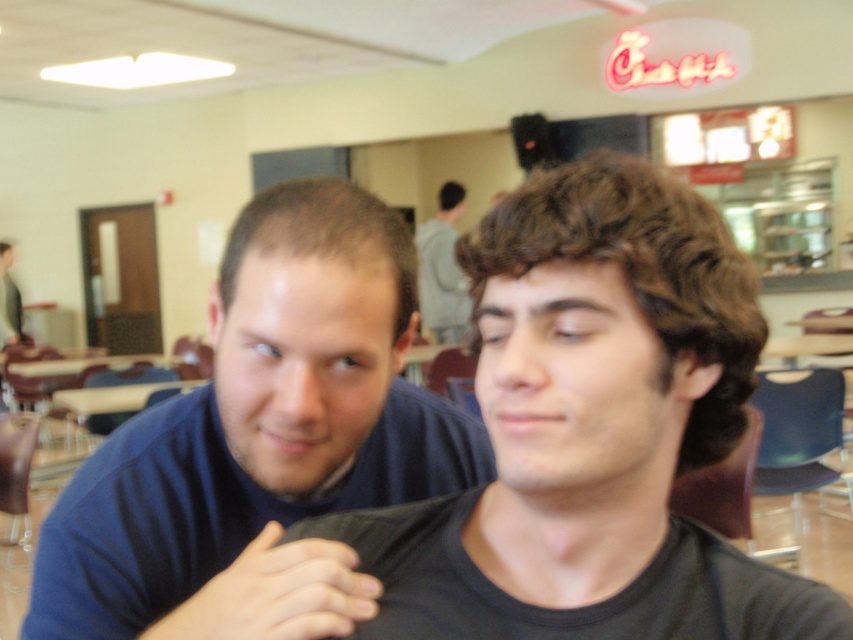
Question: Can you confirm if matte blue shirt at center is wider than black matte phone at center?

Choices:
 (A) no
 (B) yes

Answer: (B)

Question: Can you confirm if blue matte shirt at center is thinner than black matte phone at center?

Choices:
 (A) yes
 (B) no

Answer: (B)

Question: Does black matte phone at center come behind gray hoodie at upper center?

Choices:
 (A) yes
 (B) no

Answer: (B)

Question: Which of the following is the farthest from the observer?

Choices:
 (A) (206, 628)
 (B) (241, 620)
 (C) (717, 380)
 (D) (445, 320)

Answer: (D)

Question: Among these points, which one is nearest to the camera?

Choices:
 (A) (221, 616)
 (B) (438, 324)
 (C) (688, 433)

Answer: (A)

Question: Which object is farther from the camera taking this photo?

Choices:
 (A) blue matte shirt at center
 (B) matte blue shirt at center

Answer: (A)